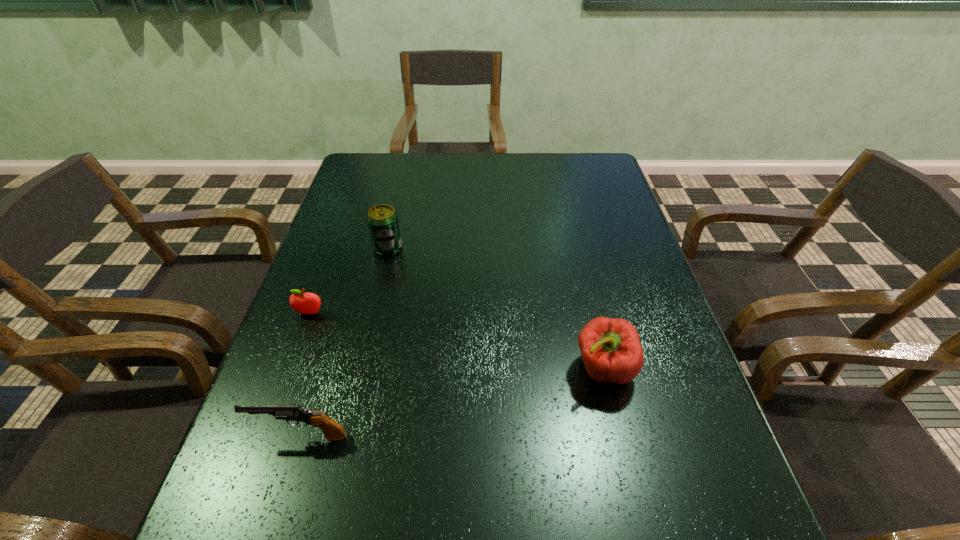
I want to click on free space that satisfies the following two spatial constraints: 1. along the barrel of the farthest object; 2. on the left side of the nearest object, so tap(358, 248).

Find the location of a particular element. vacant area that satisfies the following two spatial constraints: 1. along the barrel of the gun; 2. on the right side of the rightmost object is located at coordinates (321, 369).